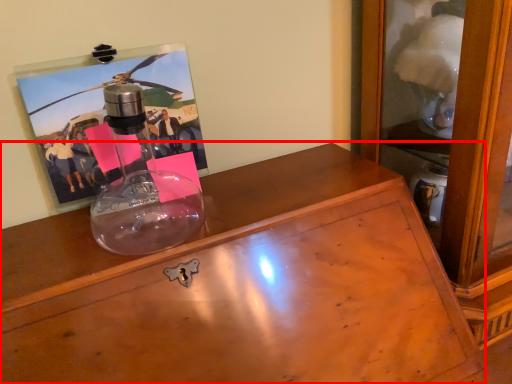
Question: Observing the image, what is the correct spatial positioning of desk (annotated by the red box) in reference to picture frame?

Choices:
 (A) right
 (B) left

Answer: (A)